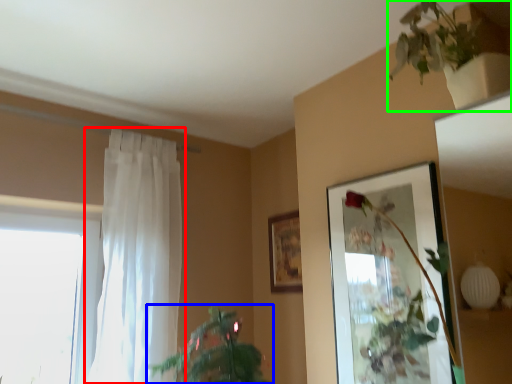
Question: Based on their relative distances, which object is farther from curtain (highlighted by a red box)? Choose from houseplant (highlighted by a blue box) and houseplant (highlighted by a green box).

Choices:
 (A) houseplant
 (B) houseplant

Answer: (B)